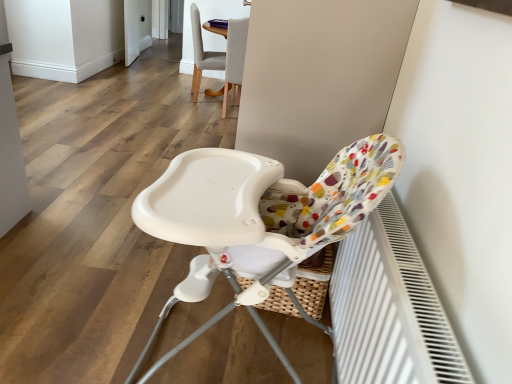
Question: In terms of height, does white textured radiator at lower right look taller or shorter compared to matte gray chair at upper center, which is counted as the 2th chair, starting from the bottom?

Choices:
 (A) short
 (B) tall

Answer: (A)

Question: Is white textured radiator at lower right wider or thinner than matte gray chair at upper center, which is counted as the 2th chair, starting from the bottom?

Choices:
 (A) wide
 (B) thin

Answer: (B)

Question: Which object is positioned closest to the light gray fabric chair at upper center, the 3th chair when ordered from bottom to top?

Choices:
 (A) matte gray chair at upper center, the 2th chair from the back
 (B) white glossy screen door at upper left
 (C) white textured radiator at lower right
 (D) white plastic highchair at center, which is the first chair from front to back

Answer: (A)

Question: Which object is positioned closest to the light gray fabric chair at upper center, arranged as the 3th chair when viewed from the front?

Choices:
 (A) matte gray chair at upper center, which is counted as the 2th chair, starting from the bottom
 (B) white plastic highchair at center, positioned as the third chair in back-to-front order
 (C) white glossy screen door at upper left
 (D) white textured radiator at lower right

Answer: (A)